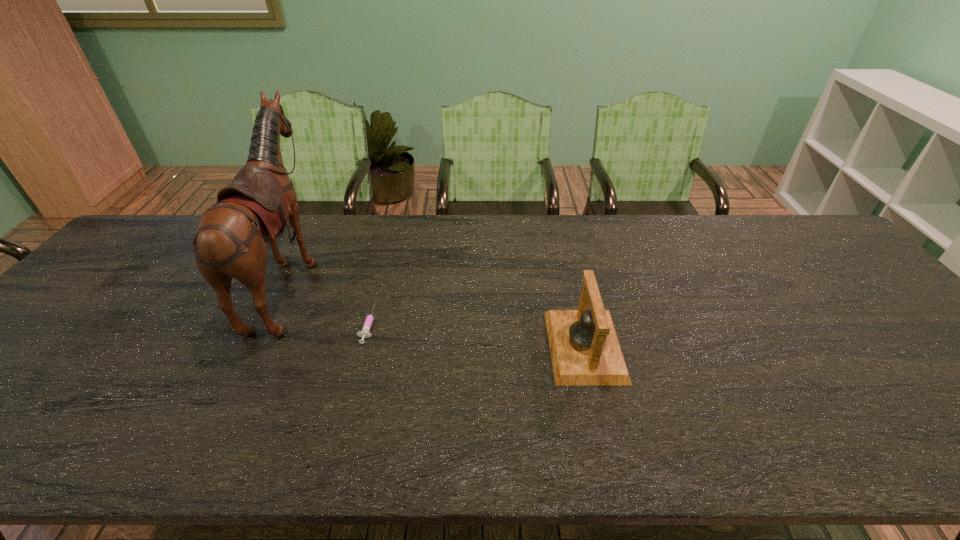
Image resolution: width=960 pixels, height=540 pixels. In the image, there is a desktop. What are the coordinates of `vacant space at the far edge` in the screenshot? It's located at (692, 219).

Where is `vacant space at the near edge of the desktop`? This screenshot has width=960, height=540. vacant space at the near edge of the desktop is located at coordinates point(63,450).

In order to click on free space at the right edge of the desktop in this screenshot , I will do `click(850, 280)`.

Identify the location of vacant space at the far left corner of the desktop. Image resolution: width=960 pixels, height=540 pixels. (163, 222).

The height and width of the screenshot is (540, 960). Identify the location of free area in between the second object from right to left and the bell. (476, 335).

The width and height of the screenshot is (960, 540). What are the coordinates of `free point between the second object from right to left and the rightmost object` in the screenshot? It's located at (476, 335).

Image resolution: width=960 pixels, height=540 pixels. I want to click on vacant area that lies between the bell and the saddle, so click(438, 313).

I want to click on free spot between the shortest object and the rightmost object, so click(x=476, y=335).

At what (x,y) coordinates should I click in order to perform the action: click on unoccupied area between the rightmost object and the second object from right to left. Please return your answer as a coordinate pair (x, y). Looking at the image, I should click on (476, 335).

Where is `unoccupied area between the second object from left to right and the saddle`? Image resolution: width=960 pixels, height=540 pixels. unoccupied area between the second object from left to right and the saddle is located at coordinates (330, 302).